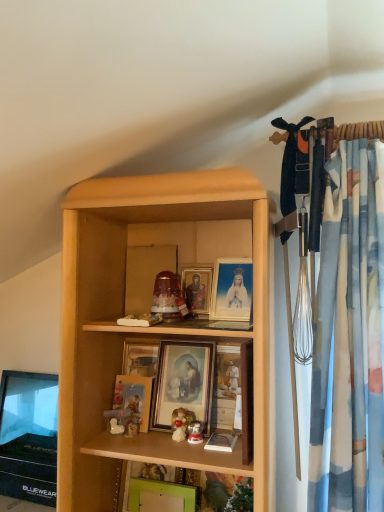
The image size is (384, 512). I want to click on matte gold picture frame at center, positioned as the second picture frame in bottom-to-top order, so click(x=134, y=397).

Measure the distance between wooden picture frame at center, acting as the 4th picture frame starting from the bottom, and camera.

4.65 feet.

What do you see at coordinates (183, 384) in the screenshot? I see `matte gold picture frame at center, marked as the 2th picture frame in a top-to-bottom arrangement` at bounding box center [183, 384].

This screenshot has height=512, width=384. I want to click on green matte picture frame at lower center, positioned as the 4th picture frame in top-to-bottom order, so click(x=160, y=493).

You are a GUI agent. You are given a task and a screenshot of the screen. Output one action in this format:
    pyautogui.click(x=<x>, y=<y>)
    Task: Click on the 1st picture frame in front of the matte gold picture frame at center, acting as the third picture frame starting from the top, starting your count from the anchor
    
    Given the screenshot: What is the action you would take?
    pyautogui.click(x=183, y=384)

Does matte gold picture frame at center, acting as the third picture frame starting from the top, appear on the right side of matte gold picture frame at center, marked as the 2th picture frame in a top-to-bottom arrangement?

No, matte gold picture frame at center, acting as the third picture frame starting from the top, is not to the right of matte gold picture frame at center, marked as the 2th picture frame in a top-to-bottom arrangement.

Can you confirm if matte gold picture frame at center, acting as the third picture frame starting from the top, is bigger than matte gold picture frame at center, marked as the 2th picture frame in a top-to-bottom arrangement?

Actually, matte gold picture frame at center, acting as the third picture frame starting from the top, might be smaller than matte gold picture frame at center, marked as the 2th picture frame in a top-to-bottom arrangement.

Is point (135, 407) behind point (208, 358)?

No, (135, 407) is in front of (208, 358).

Is point (143, 492) positioned behind point (142, 426)?

No, it is not.

Is green matte picture frame at lower center, which appears as the first picture frame when ordered from the bottom, smaller than matte gold picture frame at center, positioned as the second picture frame in bottom-to-top order?

No, green matte picture frame at lower center, which appears as the first picture frame when ordered from the bottom, is not smaller than matte gold picture frame at center, positioned as the second picture frame in bottom-to-top order.

Is matte gold picture frame at center, acting as the third picture frame starting from the top, completely or partially inside green matte picture frame at lower center, which appears as the first picture frame when ordered from the bottom?

No, matte gold picture frame at center, acting as the third picture frame starting from the top, is not surrounded by green matte picture frame at lower center, which appears as the first picture frame when ordered from the bottom.

Is matte gold picture frame at center, acting as the third picture frame starting from the top, bigger than wooden picture frame at center, acting as the 4th picture frame starting from the bottom?

Indeed, matte gold picture frame at center, acting as the third picture frame starting from the top, has a larger size compared to wooden picture frame at center, acting as the 4th picture frame starting from the bottom.

Does matte gold picture frame at center, acting as the third picture frame starting from the top, touch wooden picture frame at center, placed as the first picture frame when sorted from top to bottom?

No, matte gold picture frame at center, acting as the third picture frame starting from the top, is not touching wooden picture frame at center, placed as the first picture frame when sorted from top to bottom.

Identify the location of the 1st picture frame in front of the wooden picture frame at center, acting as the 4th picture frame starting from the bottom, starting your count from the anchor. (134, 397).

Is green matte picture frame at lower center, which appears as the first picture frame when ordered from the bottom, directly adjacent to matte gold picture frame at center, marked as the 2th picture frame in a top-to-bottom arrangement?

No, green matte picture frame at lower center, which appears as the first picture frame when ordered from the bottom, is not with matte gold picture frame at center, marked as the 2th picture frame in a top-to-bottom arrangement.

From the image's perspective, is green matte picture frame at lower center, which appears as the first picture frame when ordered from the bottom, beneath matte gold picture frame at center, the 3th picture frame when ordered from bottom to top?

Indeed, from the image's perspective, green matte picture frame at lower center, which appears as the first picture frame when ordered from the bottom, is shown beneath matte gold picture frame at center, the 3th picture frame when ordered from bottom to top.

Where is `picture frame in front of the matte gold picture frame at center, the 3th picture frame when ordered from bottom to top`? The height and width of the screenshot is (512, 384). picture frame in front of the matte gold picture frame at center, the 3th picture frame when ordered from bottom to top is located at coordinates (160, 493).

Which object is further away from the camera, green matte picture frame at lower center, which appears as the first picture frame when ordered from the bottom, or matte gold picture frame at center, marked as the 2th picture frame in a top-to-bottom arrangement?

matte gold picture frame at center, marked as the 2th picture frame in a top-to-bottom arrangement, is further away from the camera.

Considering the sizes of objects green matte picture frame at lower center, which appears as the first picture frame when ordered from the bottom, and wooden picture frame at center, acting as the 4th picture frame starting from the bottom, in the image provided, who is bigger, green matte picture frame at lower center, which appears as the first picture frame when ordered from the bottom, or wooden picture frame at center, acting as the 4th picture frame starting from the bottom,?

Bigger between the two is green matte picture frame at lower center, which appears as the first picture frame when ordered from the bottom.

Which is more distant, (142, 490) or (203, 267)?

The point (203, 267) is farther from the camera.

Considering the relative sizes of wooden picture frame at center, placed as the first picture frame when sorted from top to bottom, and green matte picture frame at lower center, positioned as the 4th picture frame in top-to-bottom order, in the image provided, is wooden picture frame at center, placed as the first picture frame when sorted from top to bottom, bigger than green matte picture frame at lower center, positioned as the 4th picture frame in top-to-bottom order,?

No.

Considering the relative sizes of wooden picture frame at center, placed as the first picture frame when sorted from top to bottom, and green matte picture frame at lower center, positioned as the 4th picture frame in top-to-bottom order, in the image provided, is wooden picture frame at center, placed as the first picture frame when sorted from top to bottom, thinner than green matte picture frame at lower center, positioned as the 4th picture frame in top-to-bottom order,?

No, wooden picture frame at center, placed as the first picture frame when sorted from top to bottom, is not thinner than green matte picture frame at lower center, positioned as the 4th picture frame in top-to-bottom order.

In the scene shown: Which point is more forward, (191,310) or (154,490)?

The point (154,490) is closer to the camera.

Is wooden picture frame at center, acting as the 4th picture frame starting from the bottom, looking in the opposite direction of green matte picture frame at lower center, positioned as the 4th picture frame in top-to-bottom order?

That's not correct — wooden picture frame at center, acting as the 4th picture frame starting from the bottom, is not looking away from green matte picture frame at lower center, positioned as the 4th picture frame in top-to-bottom order.

Is matte gold picture frame at center, marked as the 2th picture frame in a top-to-bottom arrangement, inside or outside of wooden picture frame at center, placed as the first picture frame when sorted from top to bottom?

matte gold picture frame at center, marked as the 2th picture frame in a top-to-bottom arrangement, exists outside the volume of wooden picture frame at center, placed as the first picture frame when sorted from top to bottom.

Which of these two, matte gold picture frame at center, marked as the 2th picture frame in a top-to-bottom arrangement, or wooden picture frame at center, placed as the first picture frame when sorted from top to bottom, stands shorter?

Standing shorter between the two is wooden picture frame at center, placed as the first picture frame when sorted from top to bottom.

What's the angular difference between matte gold picture frame at center, the 3th picture frame when ordered from bottom to top, and wooden picture frame at center, acting as the 4th picture frame starting from the bottom,'s facing directions?

The facing directions of matte gold picture frame at center, the 3th picture frame when ordered from bottom to top, and wooden picture frame at center, acting as the 4th picture frame starting from the bottom, are 0.00431 degrees apart.

Is matte gold picture frame at center, marked as the 2th picture frame in a top-to-bottom arrangement, at the right side of wooden picture frame at center, placed as the first picture frame when sorted from top to bottom?

No.

From the matte gold picture frame at center, positioned as the second picture frame in bottom-to-top order, count 2nd picture frame to the right and point to it. Please provide its 2D coordinates.

[(183, 384)]

Where is `picture frame that appears on the left of green matte picture frame at lower center, positioned as the 4th picture frame in top-to-bottom order`? picture frame that appears on the left of green matte picture frame at lower center, positioned as the 4th picture frame in top-to-bottom order is located at coordinates (134, 397).

In the scene shown: Estimate the real-world distances between objects in this image. Which object is further from wooden picture frame at center, acting as the 4th picture frame starting from the bottom, matte gold picture frame at center, marked as the 2th picture frame in a top-to-bottom arrangement, or green matte picture frame at lower center, which appears as the first picture frame when ordered from the bottom?

green matte picture frame at lower center, which appears as the first picture frame when ordered from the bottom, is positioned further to the anchor wooden picture frame at center, acting as the 4th picture frame starting from the bottom.

Which object lies nearer to the anchor point matte gold picture frame at center, marked as the 2th picture frame in a top-to-bottom arrangement, wooden picture frame at center, acting as the 4th picture frame starting from the bottom, or green matte picture frame at lower center, positioned as the 4th picture frame in top-to-bottom order?

Among the two, wooden picture frame at center, acting as the 4th picture frame starting from the bottom, is located nearer to matte gold picture frame at center, marked as the 2th picture frame in a top-to-bottom arrangement.

Which object lies nearer to the anchor point matte gold picture frame at center, positioned as the second picture frame in bottom-to-top order, wooden picture frame at center, placed as the first picture frame when sorted from top to bottom, or green matte picture frame at lower center, which appears as the first picture frame when ordered from the bottom?

Based on the image, green matte picture frame at lower center, which appears as the first picture frame when ordered from the bottom, appears to be nearer to matte gold picture frame at center, positioned as the second picture frame in bottom-to-top order.

From the image, which object appears to be nearer to green matte picture frame at lower center, which appears as the first picture frame when ordered from the bottom, matte gold picture frame at center, positioned as the second picture frame in bottom-to-top order, or wooden picture frame at center, acting as the 4th picture frame starting from the bottom?

Based on the image, matte gold picture frame at center, positioned as the second picture frame in bottom-to-top order, appears to be nearer to green matte picture frame at lower center, which appears as the first picture frame when ordered from the bottom.

From the image, which object appears to be nearer to green matte picture frame at lower center, which appears as the first picture frame when ordered from the bottom, wooden picture frame at center, placed as the first picture frame when sorted from top to bottom, or matte gold picture frame at center, acting as the third picture frame starting from the top?

matte gold picture frame at center, acting as the third picture frame starting from the top, lies closer to green matte picture frame at lower center, which appears as the first picture frame when ordered from the bottom, than the other object.

Estimate the real-world distances between objects in this image. Which object is further from matte gold picture frame at center, the 3th picture frame when ordered from bottom to top, matte gold picture frame at center, positioned as the second picture frame in bottom-to-top order, or wooden picture frame at center, placed as the first picture frame when sorted from top to bottom?

Based on the image, wooden picture frame at center, placed as the first picture frame when sorted from top to bottom, appears to be further to matte gold picture frame at center, the 3th picture frame when ordered from bottom to top.

When comparing their distances from matte gold picture frame at center, the 3th picture frame when ordered from bottom to top, does wooden picture frame at center, placed as the first picture frame when sorted from top to bottom, or matte gold picture frame at center, positioned as the second picture frame in bottom-to-top order, seem further?

Based on the image, wooden picture frame at center, placed as the first picture frame when sorted from top to bottom, appears to be further to matte gold picture frame at center, the 3th picture frame when ordered from bottom to top.

Estimate the real-world distances between objects in this image. Which object is further from green matte picture frame at lower center, positioned as the 4th picture frame in top-to-bottom order, matte gold picture frame at center, positioned as the second picture frame in bottom-to-top order, or matte gold picture frame at center, the 3th picture frame when ordered from bottom to top?

The object further to green matte picture frame at lower center, positioned as the 4th picture frame in top-to-bottom order, is matte gold picture frame at center, the 3th picture frame when ordered from bottom to top.

What are the coordinates of `picture frame between matte gold picture frame at center, the 3th picture frame when ordered from bottom to top, and green matte picture frame at lower center, positioned as the 4th picture frame in top-to-bottom order, in the up-down direction` in the screenshot? It's located at (134, 397).

This screenshot has width=384, height=512. Find the location of `picture frame between wooden picture frame at center, acting as the 4th picture frame starting from the bottom, and matte gold picture frame at center, positioned as the second picture frame in bottom-to-top order, in the vertical direction`. picture frame between wooden picture frame at center, acting as the 4th picture frame starting from the bottom, and matte gold picture frame at center, positioned as the second picture frame in bottom-to-top order, in the vertical direction is located at coordinates (183, 384).